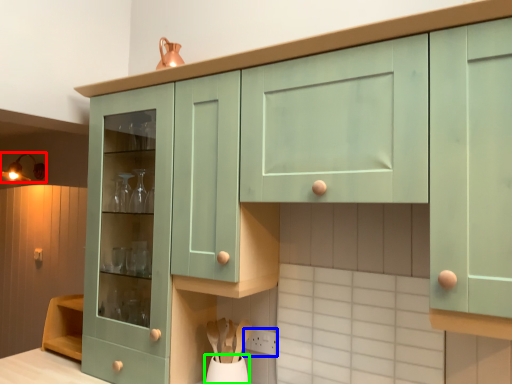
Question: Which object is the closest to the light fixture (highlighted by a red box)? Choose among these: power plugs and sockets (highlighted by a blue box) or vase (highlighted by a green box).

Choices:
 (A) power plugs and sockets
 (B) vase

Answer: (B)